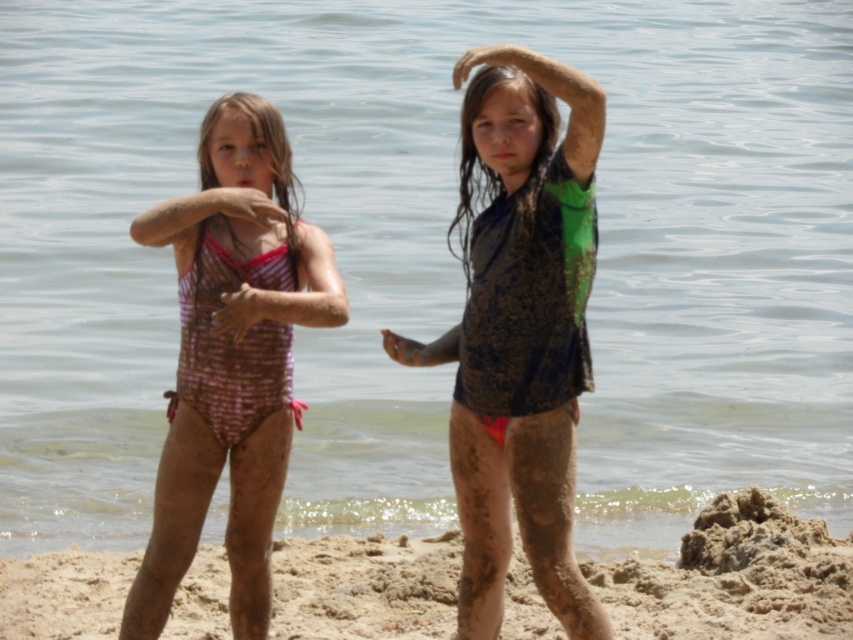
You are a photographer trying to capture the shiny green and black swimsuit at center in your shot. Given that your camera frame is centered at coordinates 0.5, 0.5, will the swimsuit be within the frame?

The shiny green and black swimsuit at center is located at point (520,330), which is very close to the camera frame centered at (426,320). Since the coordinates are nearly the same, the swimsuit should be within the frame.